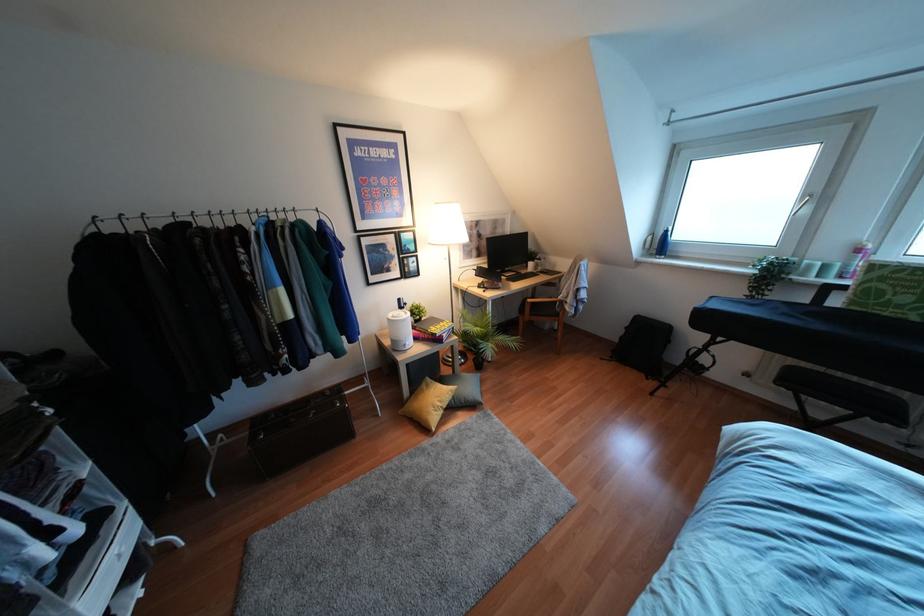
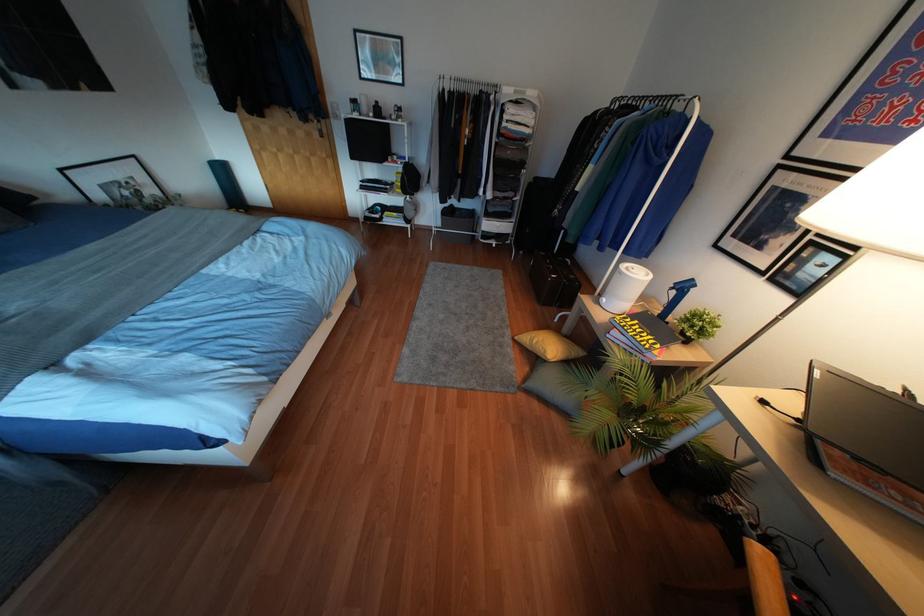
Find the pixel in the second image that matches (439,403) in the first image.

(533, 341)